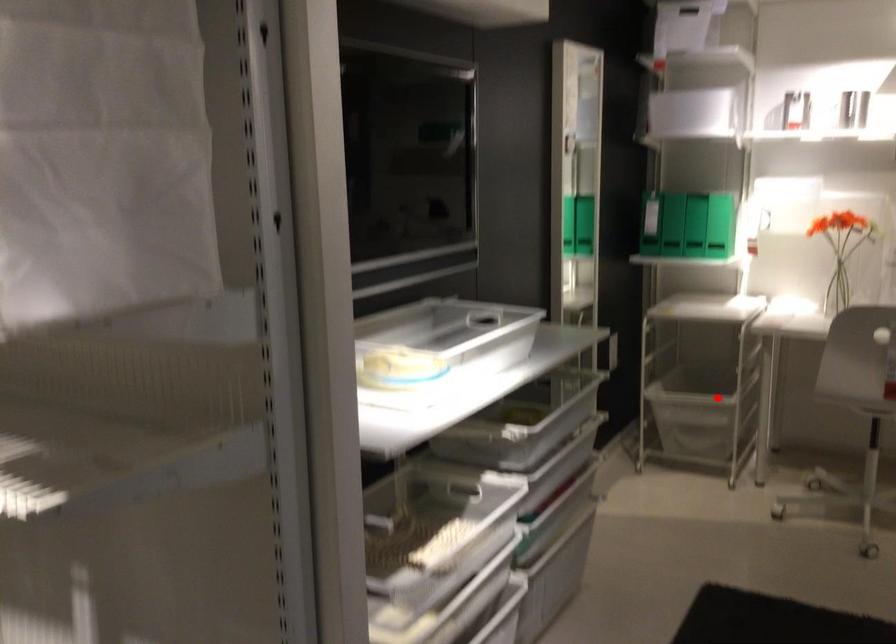
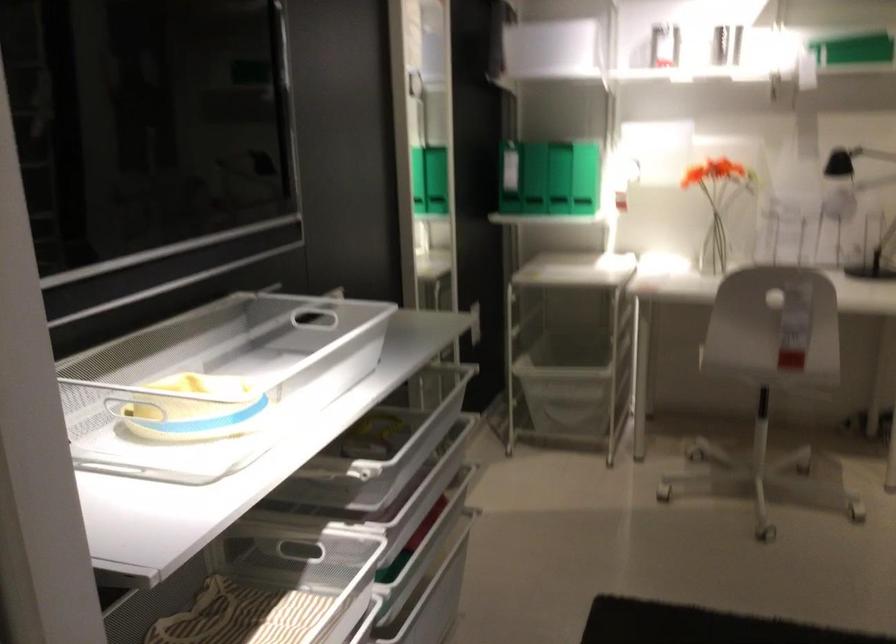
The point at the highlighted location is marked in the first image. Where is the corresponding point in the second image?

(566, 381)